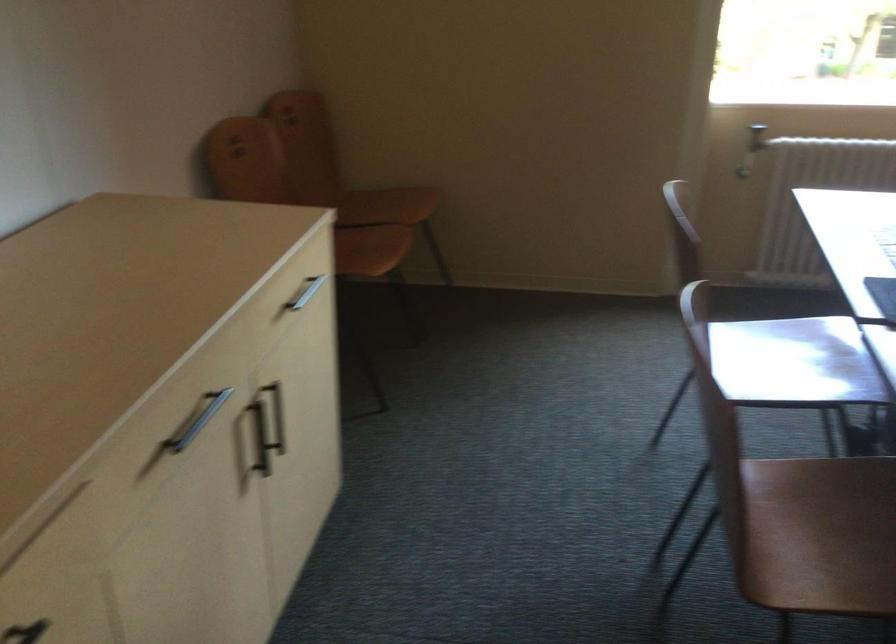
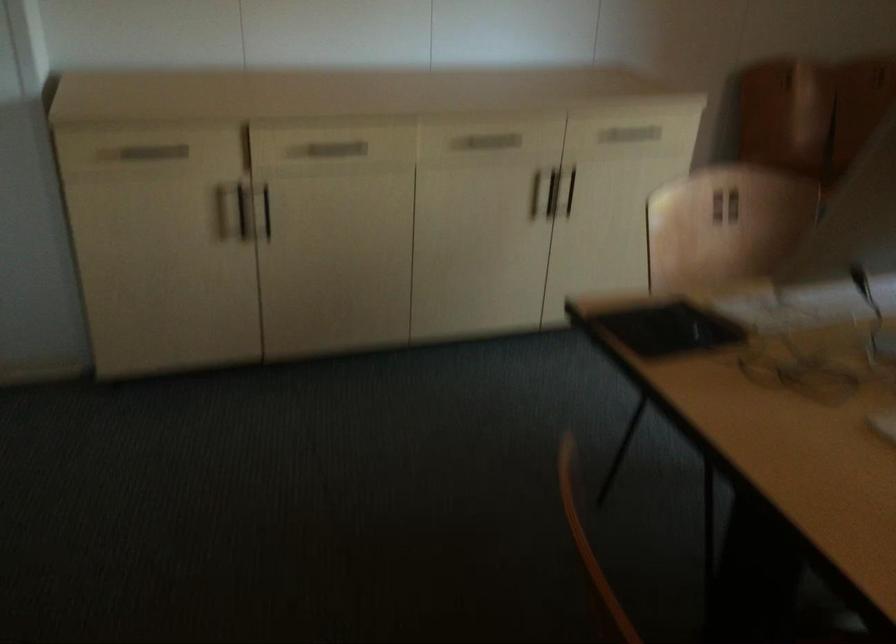
Find the pixel in the second image that matches (x=251, y=437) in the first image.

(552, 192)